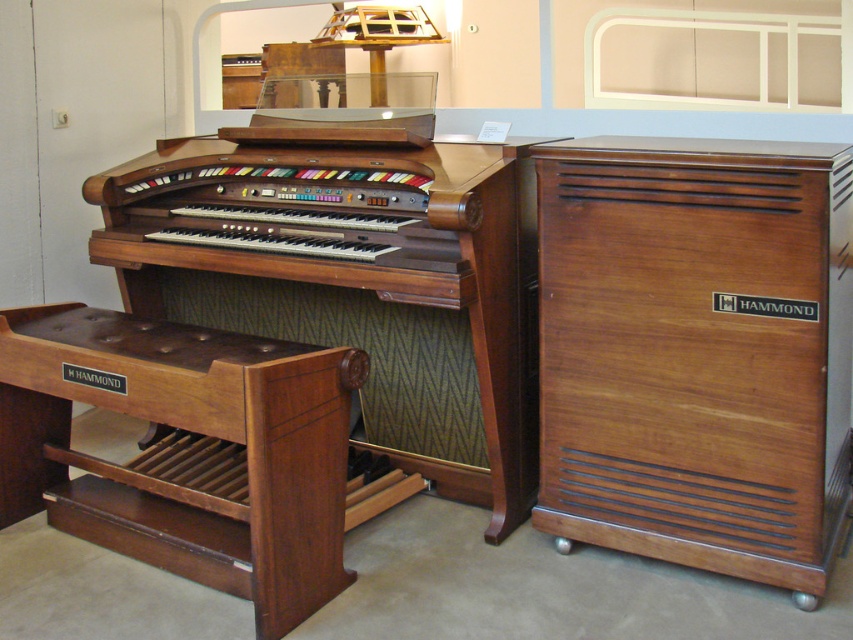
Question: Is wooden polished organ at center behind brown polished wood stool at lower left?

Choices:
 (A) yes
 (B) no

Answer: (A)

Question: Which point is farther from the camera taking this photo?

Choices:
 (A) (262, 492)
 (B) (368, 243)

Answer: (B)

Question: Which of the following is the closest to the observer?

Choices:
 (A) brown polished wood stool at lower left
 (B) wooden polished organ at center

Answer: (A)

Question: Can you confirm if wooden polished organ at center is thinner than brown polished wood stool at lower left?

Choices:
 (A) no
 (B) yes

Answer: (A)

Question: Is wooden polished organ at center wider than brown polished wood stool at lower left?

Choices:
 (A) yes
 (B) no

Answer: (A)